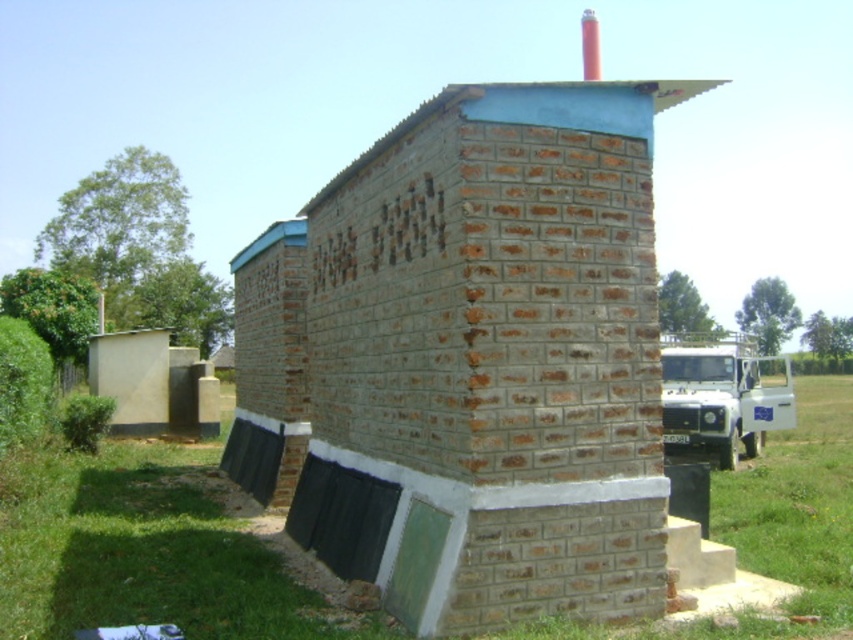
Question: Which of the following is the closest to the observer?

Choices:
 (A) (613, 128)
 (B) (592, 17)

Answer: (A)

Question: Where is brown brick hut at center located in relation to smooth red chimney at upper center in the image?

Choices:
 (A) right
 (B) left

Answer: (B)

Question: Among these objects, which one is farthest from the camera?

Choices:
 (A) smooth red chimney at upper center
 (B) brown brick hut at center

Answer: (A)

Question: Is brown brick hut at center positioned in front of smooth red chimney at upper center?

Choices:
 (A) no
 (B) yes

Answer: (B)

Question: In this image, where is brown brick hut at center located relative to smooth red chimney at upper center?

Choices:
 (A) left
 (B) right

Answer: (A)

Question: Which point is farther from the camera taking this photo?

Choices:
 (A) (596, 54)
 (B) (339, 301)

Answer: (A)